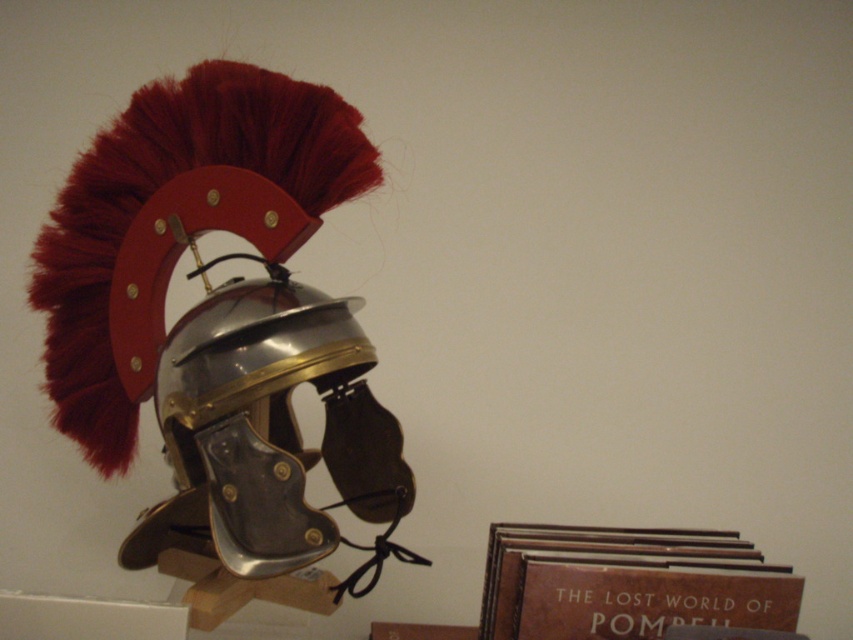
Is metallic silver helmet at center positioned in front of brown leather book at lower right?

Yes, it is in front of brown leather book at lower right.

Does metallic silver helmet at center have a greater height compared to brown leather book at lower right?

Indeed, metallic silver helmet at center has a greater height compared to brown leather book at lower right.

Locate an element on the screen. metallic silver helmet at center is located at coordinates (270, 432).

This screenshot has width=853, height=640. I want to click on metallic silver helmet at center, so click(x=270, y=432).